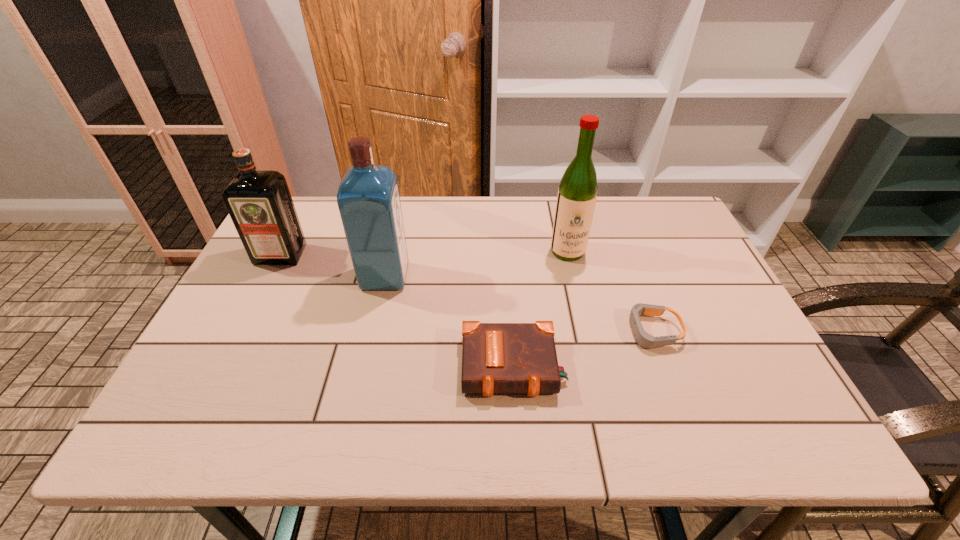
Image resolution: width=960 pixels, height=540 pixels. I want to click on free space between the second shortest object and the shortest liquor, so click(397, 310).

Locate an element on the screen. The image size is (960, 540). free space between the rightmost liquor and the Bible is located at coordinates (540, 309).

Identify the location of free space between the rightmost object and the fourth object from left to right. (610, 291).

Find the location of a particular element. This screenshot has height=540, width=960. vacant region between the second liquor from right to left and the third object from right to left is located at coordinates (449, 322).

Locate an element on the screen. free space between the second liquor from left to right and the rightmost liquor is located at coordinates (476, 264).

This screenshot has width=960, height=540. I want to click on free spot between the rightmost liquor and the second object from left to right, so click(476, 264).

Locate an element on the screen. The image size is (960, 540). free space between the fourth object from right to left and the leftmost liquor is located at coordinates (333, 266).

You are a GUI agent. You are given a task and a screenshot of the screen. Output one action in this format:
    pyautogui.click(x=<x>, y=<y>)
    Task: Click on the free space between the shortest object and the fourth tallest object
    
    Given the screenshot: What is the action you would take?
    pyautogui.click(x=583, y=349)

I want to click on free space between the second liquor from left to right and the third tallest object, so click(x=333, y=266).

Locate an element on the screen. free space between the shortest liquor and the fourth object from left to right is located at coordinates (424, 253).